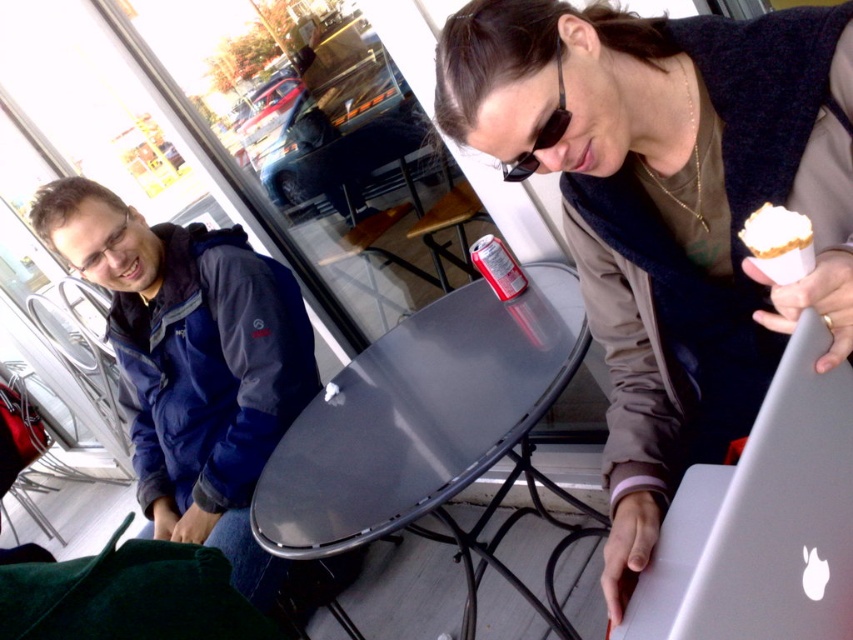
Question: Can you confirm if white paper ice cream cone at upper right is positioned below sunglasses at center?

Choices:
 (A) yes
 (B) no

Answer: (A)

Question: Among these objects, which one is farthest from the camera?

Choices:
 (A) glossy metal table at center
 (B) matte black jacket at center
 (C) silver metallic laptop at center
 (D) sunglasses at center

Answer: (A)

Question: Can you confirm if blue fabric jacket at left is thinner than glossy metal table at center?

Choices:
 (A) no
 (B) yes

Answer: (A)

Question: Which object is closer to the camera taking this photo?

Choices:
 (A) glossy metal table at center
 (B) silver metallic laptop at center
 (C) blue fabric jacket at left
 (D) sunglasses at center

Answer: (B)

Question: Can you confirm if matte black jacket at center is bigger than silver metallic laptop at center?

Choices:
 (A) yes
 (B) no

Answer: (A)

Question: Based on their relative distances, which object is nearer to the sunglasses at center?

Choices:
 (A) silver metallic laptop at center
 (B) white paper ice cream cone at upper right
 (C) glossy metal table at center
 (D) matte black jacket at center

Answer: (D)